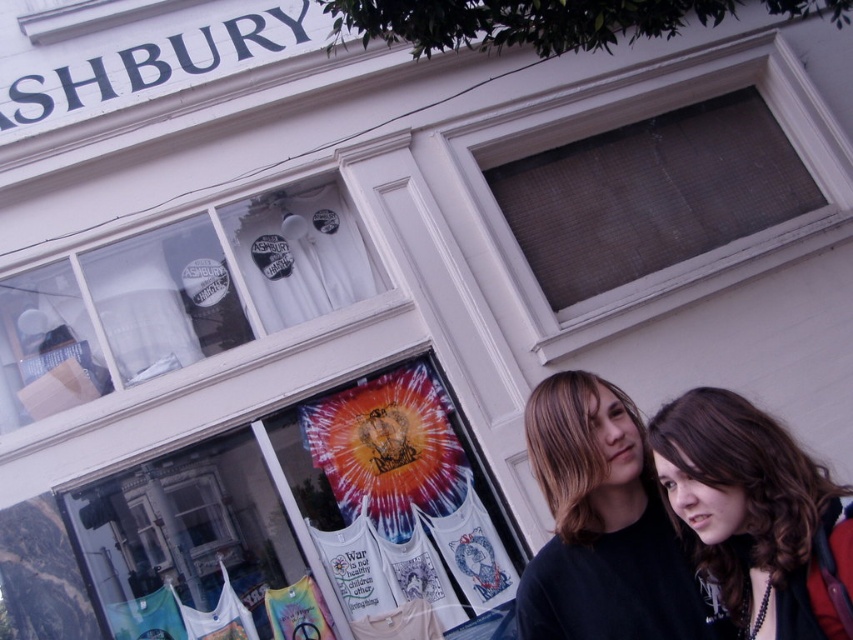
Is white frosted glass at upper center closer to camera compared to matte glass window at upper center?

Yes, it is in front of matte glass window at upper center.

Is white frosted glass at upper center wider than matte glass window at upper center?

No, white frosted glass at upper center is not wider than matte glass window at upper center.

Between point (3, 308) and point (630, 248), which one is positioned in front?

Point (3, 308) is more forward.

I want to click on white frosted glass at upper center, so click(178, 296).

Can you confirm if matte glass window at upper center is positioned to the right of matte black shirt at center?

Yes, matte glass window at upper center is to the right of matte black shirt at center.

Between matte glass window at upper center and matte black shirt at center, which one appears on the left side from the viewer's perspective?

matte black shirt at center

Does point (786, 186) lie behind point (657, 636)?

Yes, it is behind point (657, 636).

Identify the location of matte glass window at upper center. This screenshot has width=853, height=640. (650, 195).

Can you confirm if matte black shirt at center is positioned below brown curly hair at center?

Yes.

Between matte black shirt at center and brown curly hair at center, which one has less height?

brown curly hair at center

Does point (526, 426) come in front of point (700, 493)?

No, (526, 426) is behind (700, 493).

Locate an element on the screen. The width and height of the screenshot is (853, 640). matte black shirt at center is located at coordinates click(601, 524).